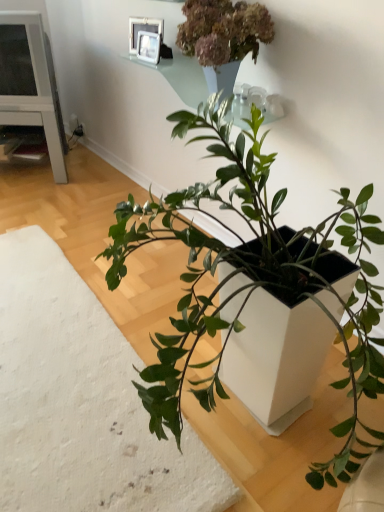
Measure the distance between point (179,510) and camera.

A distance of 3.89 feet exists between point (179,510) and camera.

This screenshot has height=512, width=384. What do you see at coordinates (148, 47) in the screenshot? I see `metallic silver picture frame at upper center, marked as the 2th picture frame in a top-to-bottom arrangement` at bounding box center [148, 47].

Measure the distance between glassy white vase at upper center and camera.

5.58 feet.

Locate an element on the screen. The width and height of the screenshot is (384, 512). glassy white vase at upper center is located at coordinates (182, 77).

Locate an element on the screen. The width and height of the screenshot is (384, 512). white glossy table at left is located at coordinates (37, 125).

This screenshot has width=384, height=512. In order to click on white matte planter at lower left in this screenshot , I will do `click(81, 402)`.

Considering the sizes of objects green matte plant at upper center, which ranks as the first houseplant in right-to-left order, and metallic silver picture frame at upper center, marked as the 2th picture frame in a top-to-bottom arrangement, in the image provided, who is thinner, green matte plant at upper center, which ranks as the first houseplant in right-to-left order, or metallic silver picture frame at upper center, marked as the 2th picture frame in a top-to-bottom arrangement,?

metallic silver picture frame at upper center, marked as the 2th picture frame in a top-to-bottom arrangement, is thinner.

The height and width of the screenshot is (512, 384). What are the coordinates of `houseplant above the metallic silver picture frame at upper center, marked as the 2th picture frame in a top-to-bottom arrangement (from a real-world perspective)` in the screenshot? It's located at (223, 37).

Is green matte plant at upper center, which ranks as the first houseplant in right-to-left order, outside of metallic silver picture frame at upper center, which ranks as the first picture frame in bottom-to-top order?

Indeed, green matte plant at upper center, which ranks as the first houseplant in right-to-left order, is completely outside metallic silver picture frame at upper center, which ranks as the first picture frame in bottom-to-top order.

Is point (194, 0) positioned in front of point (150, 56)?

Yes, it is in front of point (150, 56).

Is metallic silver picture frame at upper center, which ranks as the first picture frame in bottom-to-top order, next to white glossy picture frame at upper center, which is the first picture frame in top-to-bottom order, and touching it?

Yes.

Is metallic silver picture frame at upper center, which ranks as the first picture frame in bottom-to-top order, facing away from white glossy picture frame at upper center, arranged as the second picture frame when ordered from the bottom?

Correct, metallic silver picture frame at upper center, which ranks as the first picture frame in bottom-to-top order, is looking away from white glossy picture frame at upper center, arranged as the second picture frame when ordered from the bottom.

Is metallic silver picture frame at upper center, which ranks as the first picture frame in bottom-to-top order, to the right of white glossy picture frame at upper center, which is the first picture frame in top-to-bottom order, from the viewer's perspective?

Yes.

Considering the positions of objects metallic silver picture frame at upper center, which ranks as the first picture frame in bottom-to-top order, and white glossy picture frame at upper center, which is the first picture frame in top-to-bottom order, in the image provided, who is behind, metallic silver picture frame at upper center, which ranks as the first picture frame in bottom-to-top order, or white glossy picture frame at upper center, which is the first picture frame in top-to-bottom order,?

white glossy picture frame at upper center, which is the first picture frame in top-to-bottom order, is more distant.

Is white matte planter at lower left touching glassy white vase at upper center?

No, white matte planter at lower left is not making contact with glassy white vase at upper center.

Does point (34, 286) come in front of point (257, 104)?

No, (34, 286) is behind (257, 104).

Which of these two, white matte planter at lower left or glassy white vase at upper center, is smaller?

glassy white vase at upper center is smaller.

Which is correct: white matte planter at lower left is inside glassy white vase at upper center, or outside of it?

The correct answer is: outside.

Could you tell me if white matte planter at center, which ranks as the 2th houseplant in right-to-left order, is facing glassy white vase at upper center?

No.

Measure the distance from white matte planter at center, which ranks as the 2th houseplant in right-to-left order, to glassy white vase at upper center.

The distance of white matte planter at center, which ranks as the 2th houseplant in right-to-left order, from glassy white vase at upper center is 34.62 inches.

Which object is closer to the camera taking this photo, white matte planter at center, which ranks as the 2th houseplant in right-to-left order, or glassy white vase at upper center?

Positioned in front is white matte planter at center, which ranks as the 2th houseplant in right-to-left order.

Based on the photo, which object is wider, white matte planter at center, marked as the 1th houseplant in a left-to-right arrangement, or glassy white vase at upper center?

With larger width is white matte planter at center, marked as the 1th houseplant in a left-to-right arrangement.

From the image's perspective, would you say white matte planter at lower left is positioned over white glossy picture frame at upper center, which is the first picture frame in top-to-bottom order?

No, from the image's perspective, white matte planter at lower left is not above white glossy picture frame at upper center, which is the first picture frame in top-to-bottom order.

Considering the sizes of white matte planter at lower left and white glossy picture frame at upper center, which is the first picture frame in top-to-bottom order, in the image, is white matte planter at lower left taller or shorter than white glossy picture frame at upper center, which is the first picture frame in top-to-bottom order,?

In the image, white matte planter at lower left appears to be shorter than white glossy picture frame at upper center, which is the first picture frame in top-to-bottom order.

Looking at this image, is white matte planter at lower left aimed at white glossy picture frame at upper center, arranged as the second picture frame when ordered from the bottom?

→ No, white matte planter at lower left is not turned towards white glossy picture frame at upper center, arranged as the second picture frame when ordered from the bottom.

Is white glossy table at left wider or thinner than white matte planter at center, marked as the 1th houseplant in a left-to-right arrangement?

In the image, white glossy table at left appears to be more narrow than white matte planter at center, marked as the 1th houseplant in a left-to-right arrangement.

Which object is positioned more to the right, white glossy table at left or white matte planter at center, marked as the 1th houseplant in a left-to-right arrangement?

white matte planter at center, marked as the 1th houseplant in a left-to-right arrangement, is more to the right.

In the scene shown: Could you tell me if white glossy table at left is facing white matte planter at center, which ranks as the 2th houseplant in right-to-left order?

Yes.

From a real-world perspective, who is located higher, white glossy table at left or white matte planter at center, which ranks as the 2th houseplant in right-to-left order?

white glossy table at left, from a real-world perspective.

From the picture: Which point is more distant from viewer, (50,106) or (158,53)?

The point (50,106) is behind.

Is white glossy table at left far from metallic silver picture frame at upper center, marked as the 2th picture frame in a top-to-bottom arrangement?

white glossy table at left is actually quite close to metallic silver picture frame at upper center, marked as the 2th picture frame in a top-to-bottom arrangement.

Find the location of a particular element. The width and height of the screenshot is (384, 512). picture frame that is the 1st object located above the white glossy table at left (from the image's perspective) is located at coordinates (148, 47).

The image size is (384, 512). I want to click on houseplant that is above the metallic silver picture frame at upper center, marked as the 2th picture frame in a top-to-bottom arrangement (from a real-world perspective), so click(223, 37).

Where is `picture frame located below the white glossy picture frame at upper center, which is the first picture frame in top-to-bottom order (from the image's perspective)`? Image resolution: width=384 pixels, height=512 pixels. picture frame located below the white glossy picture frame at upper center, which is the first picture frame in top-to-bottom order (from the image's perspective) is located at coordinates pyautogui.click(x=148, y=47).

Considering their positions, is glassy white vase at upper center positioned further to white matte planter at center, marked as the 1th houseplant in a left-to-right arrangement, than white glossy picture frame at upper center, which is the first picture frame in top-to-bottom order?

white glossy picture frame at upper center, which is the first picture frame in top-to-bottom order, is further to white matte planter at center, marked as the 1th houseplant in a left-to-right arrangement.

When comparing their distances from metallic silver picture frame at upper center, which ranks as the first picture frame in bottom-to-top order, does white glossy table at left or glassy white vase at upper center seem further?

The object further to metallic silver picture frame at upper center, which ranks as the first picture frame in bottom-to-top order, is white glossy table at left.

From the image, which object appears to be nearer to white glossy picture frame at upper center, which is the first picture frame in top-to-bottom order, white matte planter at lower left or metallic silver picture frame at upper center, which ranks as the first picture frame in bottom-to-top order?

Based on the image, metallic silver picture frame at upper center, which ranks as the first picture frame in bottom-to-top order, appears to be nearer to white glossy picture frame at upper center, which is the first picture frame in top-to-bottom order.

When comparing their distances from metallic silver picture frame at upper center, which ranks as the first picture frame in bottom-to-top order, does green matte plant at upper center, which ranks as the first houseplant in right-to-left order, or white glossy table at left seem further?

white glossy table at left is positioned further to the anchor metallic silver picture frame at upper center, which ranks as the first picture frame in bottom-to-top order.

Looking at this image, looking at the image, which one is located closer to white matte planter at center, marked as the 1th houseplant in a left-to-right arrangement, white glossy table at left or green matte plant at upper center, which ranks as the first houseplant in right-to-left order?

Based on the image, green matte plant at upper center, which ranks as the first houseplant in right-to-left order, appears to be nearer to white matte planter at center, marked as the 1th houseplant in a left-to-right arrangement.

When comparing their distances from white glossy table at left, does white glossy picture frame at upper center, arranged as the second picture frame when ordered from the bottom, or green matte plant at upper center, which is counted as the 2th houseplant, starting from the left, seem further?

green matte plant at upper center, which is counted as the 2th houseplant, starting from the left.

From the picture: From the image, which object appears to be farther from glassy white vase at upper center, white glossy table at left or metallic silver picture frame at upper center, which ranks as the first picture frame in bottom-to-top order?

white glossy table at left.

Based on the photo, estimate the real-world distances between objects in this image. Which object is closer to green matte plant at upper center, which is counted as the 2th houseplant, starting from the left, white matte planter at lower left or glassy white vase at upper center?

glassy white vase at upper center is closer to green matte plant at upper center, which is counted as the 2th houseplant, starting from the left.

You are a GUI agent. You are given a task and a screenshot of the screen. Output one action in this format:
    pyautogui.click(x=<x>, y=<y>)
    Task: Click on the window sill located between white matte planter at center, marked as the 1th houseplant in a left-to-right arrangement, and metallic silver picture frame at upper center, marked as the 2th picture frame in a top-to-bottom arrangement, in the depth direction
    This screenshot has height=512, width=384.
    Given the screenshot: What is the action you would take?
    pyautogui.click(x=182, y=77)

What are the coordinates of `picture frame between white matte planter at center, marked as the 1th houseplant in a left-to-right arrangement, and white glossy picture frame at upper center, which is the first picture frame in top-to-bottom order, from front to back` in the screenshot? It's located at (148, 47).

Locate an element on the screen. The width and height of the screenshot is (384, 512). houseplant between white matte planter at center, marked as the 1th houseplant in a left-to-right arrangement, and white glossy picture frame at upper center, arranged as the second picture frame when ordered from the bottom, along the z-axis is located at coordinates (223, 37).

Locate an element on the screen. Image resolution: width=384 pixels, height=512 pixels. houseplant between white matte planter at lower left and white glossy table at left in the front-back direction is located at coordinates (223, 37).